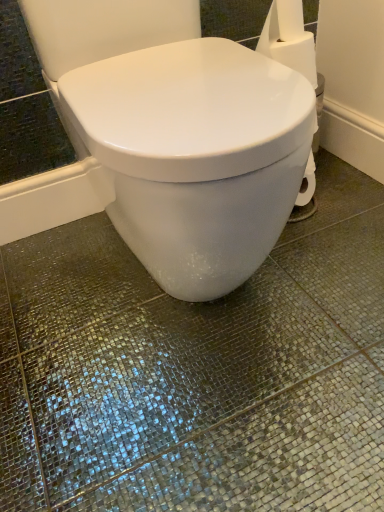
Measure the distance between white paper at upper right and camera.

A distance of 27.07 inches exists between white paper at upper right and camera.

What do you see at coordinates (289, 39) in the screenshot?
I see `white paper at upper right` at bounding box center [289, 39].

Locate an element on the screen. This screenshot has height=512, width=384. white paper at upper right is located at coordinates (289, 39).

Locate an element on the screen. This screenshot has width=384, height=512. white glossy toilet at center is located at coordinates (196, 156).

Measure the distance between white glossy toilet at center and camera.

A distance of 21.26 inches exists between white glossy toilet at center and camera.

Describe the element at coordinates (196, 156) in the screenshot. This screenshot has height=512, width=384. I see `white glossy toilet at center` at that location.

This screenshot has height=512, width=384. I want to click on white paper at upper right, so click(289, 39).

Which is more to the left, white glossy toilet at center or white paper at upper right?

From the viewer's perspective, white glossy toilet at center appears more on the left side.

In the scene shown: Relative to white paper at upper right, is white glossy toilet at center in front or behind?

white glossy toilet at center is in front of white paper at upper right.

Does point (145, 82) come closer to viewer compared to point (293, 10)?

Yes, point (145, 82) is in front of point (293, 10).

From the image's perspective, is white glossy toilet at center on white paper at upper right?

No, from the image's perspective, white glossy toilet at center is not over white paper at upper right.

From a real-world perspective, is white glossy toilet at center physically located above or below white paper at upper right?

From a real-world perspective, white glossy toilet at center is physically below white paper at upper right.

Is white glossy toilet at center thinner than white paper at upper right?

In fact, white glossy toilet at center might be wider than white paper at upper right.

Who is shorter, white glossy toilet at center or white paper at upper right?

With less height is white paper at upper right.

Between white glossy toilet at center and white paper at upper right, which one has larger size?

white glossy toilet at center is bigger.

Is white glossy toilet at center situated inside white paper at upper right or outside?

white glossy toilet at center is spatially situated outside white paper at upper right.

Are white glossy toilet at center and white paper at upper right beside each other?

They are not placed beside each other.

Is white glossy toilet at center oriented towards white paper at upper right?

No, white glossy toilet at center is not turned towards white paper at upper right.

What's the angular difference between white glossy toilet at center and white paper at upper right's facing directions?

89.9 degrees separate the facing orientations of white glossy toilet at center and white paper at upper right.

How distant is white glossy toilet at center from white paper at upper right?

They are 9.76 inches apart.

Identify the location of toilet paper lying on the right of white glossy toilet at center. (289, 39).

Which is more to the right, white paper at upper right or white glossy toilet at center?

white paper at upper right.

Looking at this image, is the depth of white paper at upper right greater than that of white glossy toilet at center?

Yes, it is.

Is point (269, 31) in front of point (150, 125)?

No, (269, 31) is behind (150, 125).

From the image's perspective, which is below, white paper at upper right or white glossy toilet at center?

white glossy toilet at center.

From a real-world perspective, which object stands above the other?

white paper at upper right.

In terms of width, does white paper at upper right look wider or thinner when compared to white glossy toilet at center?

In the image, white paper at upper right appears to be more narrow than white glossy toilet at center.

Which of these two, white paper at upper right or white glossy toilet at center, stands shorter?

Standing shorter between the two is white paper at upper right.

Between white paper at upper right and white glossy toilet at center, which one has larger size?

white glossy toilet at center is bigger.

In the scene shown: Can white glossy toilet at center be found inside white paper at upper right?

No, white glossy toilet at center is not surrounded by white paper at upper right.

Looking at this image, are white paper at upper right and white glossy toilet at center far apart?

No, white paper at upper right is not far away from white glossy toilet at center.

Is white paper at upper right facing away from white glossy toilet at center?

No, white paper at upper right's orientation is not away from white glossy toilet at center.

How different are the orientations of white paper at upper right and white glossy toilet at center in degrees?

89.9 degrees.

The width and height of the screenshot is (384, 512). Identify the location of toilet below the white paper at upper right (from a real-world perspective). (196, 156).

At what (x,y) coordinates should I click in order to perform the action: click on toilet paper that appears behind the white glossy toilet at center. Please return your answer as a coordinate pair (x, y). Looking at the image, I should click on (289, 39).

Find the location of a particular element. This screenshot has height=512, width=384. toilet below the white paper at upper right (from a real-world perspective) is located at coordinates (196, 156).